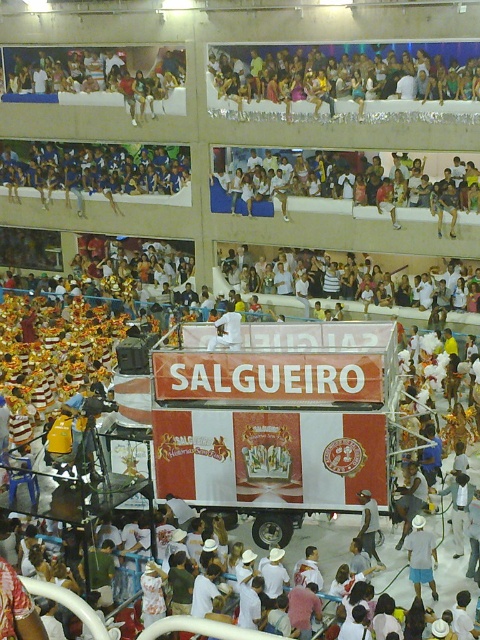
Is white cotton shorts at center bigger than white plastic bag at center?

No, white cotton shorts at center is not bigger than white plastic bag at center.

Can you confirm if white cotton shorts at center is wider than white plastic bag at center?

Incorrect, white cotton shorts at center's width does not surpass white plastic bag at center's.

At what (x,y) coordinates should I click in order to perform the action: click on white cotton shorts at center. Please return your answer as a coordinate pair (x, y). Looking at the image, I should click on (420, 556).

Find the location of a particular element. This screenshot has width=480, height=640. white cotton shorts at center is located at coordinates (420, 556).